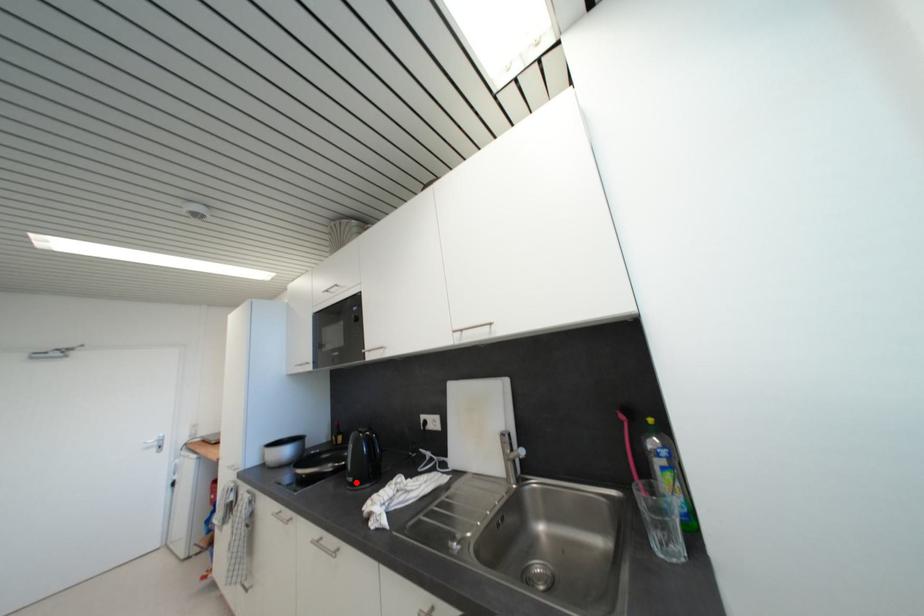
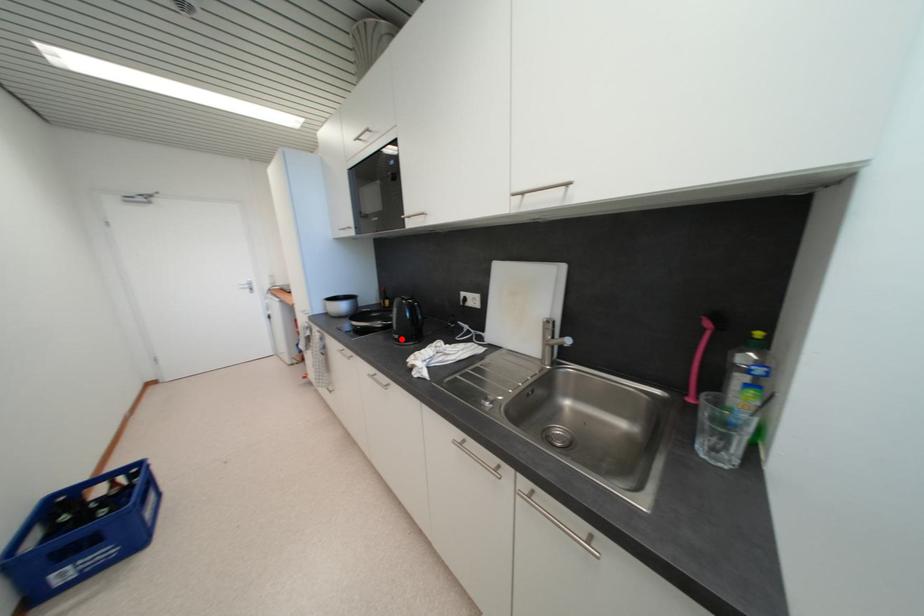
I am providing you with two images of the same scene from different viewpoints. A red point is marked on the first image and another point is marked on the second image. Do the highlighted points in image1 and image2 indicate the same real-world spot?

Yes